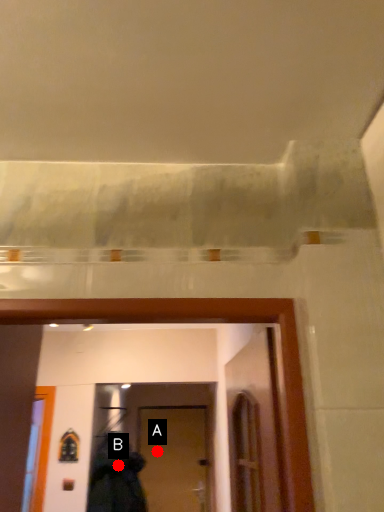
Question: Two points are circled on the image, labeled by A and B beside each circle. Which point appears closest to the camera in this image?

Choices:
 (A) A is closer
 (B) B is closer

Answer: (B)